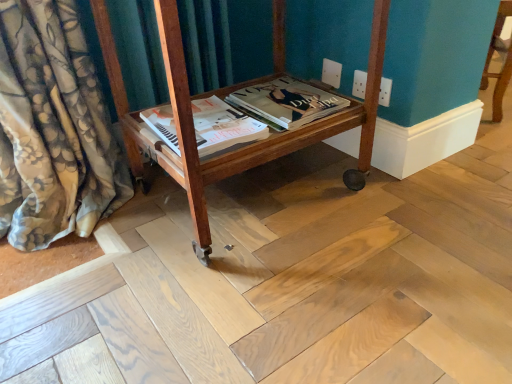
This screenshot has height=384, width=512. In order to click on wooden cart at center in this screenshot , I will do `click(240, 149)`.

Identify the location of wooden cart at center. This screenshot has height=384, width=512. (240, 149).

From a real-world perspective, who is located lower, matte paper magazine at center, which is the 1th magazine from left to right, or matte paper magazine at center, the second magazine in the left-to-right sequence?

matte paper magazine at center, the second magazine in the left-to-right sequence, is physically lower.

Which is nearer, (x=224, y=137) or (x=282, y=113)?

Point (x=224, y=137)

Could matte paper magazine at center, the second magazine in the left-to-right sequence, be considered to be inside matte paper magazine at center, which is the 1th magazine from left to right?

No, matte paper magazine at center, the second magazine in the left-to-right sequence, is located outside of matte paper magazine at center, which is the 1th magazine from left to right.

Looking at this image, is matte paper magazine at center, which is the 1th magazine from left to right, located within matte paper magazine at center, which appears as the 1th magazine when viewed from the right?

That's incorrect, matte paper magazine at center, which is the 1th magazine from left to right, is not inside matte paper magazine at center, which appears as the 1th magazine when viewed from the right.

Is matte paper magazine at center, which appears as the 1th magazine when viewed from the right, with matte paper magazine at center, the 2th magazine positioned from the right?

No, matte paper magazine at center, which appears as the 1th magazine when viewed from the right, is not with matte paper magazine at center, the 2th magazine positioned from the right.

Is matte paper magazine at center, the second magazine in the left-to-right sequence, taller or shorter than matte paper magazine at center, the 2th magazine positioned from the right?

Considering their sizes, matte paper magazine at center, the second magazine in the left-to-right sequence, has more height than matte paper magazine at center, the 2th magazine positioned from the right.

From a real-world perspective, is matte paper magazine at center, which appears as the 1th magazine when viewed from the right, over matte paper magazine at center, the 2th magazine positioned from the right?

No, from a real-world perspective, matte paper magazine at center, which appears as the 1th magazine when viewed from the right, is not over matte paper magazine at center, the 2th magazine positioned from the right

Considering the relative positions of wooden cart at center and matte paper magazine at center, which appears as the 1th magazine when viewed from the right, in the image provided, is wooden cart at center to the left of matte paper magazine at center, which appears as the 1th magazine when viewed from the right, from the viewer's perspective?

Indeed, wooden cart at center is positioned on the left side of matte paper magazine at center, which appears as the 1th magazine when viewed from the right.

Can you confirm if wooden cart at center is smaller than matte paper magazine at center, the second magazine in the left-to-right sequence?

No.

Does wooden cart at center turn towards matte paper magazine at center, which appears as the 1th magazine when viewed from the right?

Yes, wooden cart at center is oriented towards matte paper magazine at center, which appears as the 1th magazine when viewed from the right.

Would you say wooden cart at center is a long distance from matte paper magazine at center, which appears as the 1th magazine when viewed from the right?

That's not correct — wooden cart at center is a little close to matte paper magazine at center, which appears as the 1th magazine when viewed from the right.

Is matte paper magazine at center, the 2th magazine positioned from the right, bigger or smaller than wooden cart at center?

In the image, matte paper magazine at center, the 2th magazine positioned from the right, appears to be smaller than wooden cart at center.

Can you confirm if matte paper magazine at center, the 2th magazine positioned from the right, is shorter than wooden cart at center?

Yes, matte paper magazine at center, the 2th magazine positioned from the right, is shorter than wooden cart at center.

Where is `furniture on the right of matte paper magazine at center, which is the 1th magazine from left to right`? furniture on the right of matte paper magazine at center, which is the 1th magazine from left to right is located at coordinates (240, 149).

From the image's perspective, is wooden cart at center located beneath matte paper magazine at center, the 2th magazine positioned from the right?

No.

There is a matte paper magazine at center, which is the 1th magazine from left to right. Identify the location of furniture above it (from a real-world perspective). (240, 149).

Does point (201, 166) lie behind point (210, 110)?

No, (201, 166) is closer to viewer.

Does point (314, 91) appear closer or farther from the camera than point (139, 161)?

Point (314, 91) appears to be closer to the viewer than point (139, 161).

From a real-world perspective, is matte paper magazine at center, the second magazine in the left-to-right sequence, under wooden cart at center?

Correct, in the physical world, matte paper magazine at center, the second magazine in the left-to-right sequence, is lower than wooden cart at center.

Measure the distance from matte paper magazine at center, the second magazine in the left-to-right sequence, to wooden cart at center.

matte paper magazine at center, the second magazine in the left-to-right sequence, is 7.52 inches from wooden cart at center.

Where is `furniture that is in front of the matte paper magazine at center, the second magazine in the left-to-right sequence`? The image size is (512, 384). furniture that is in front of the matte paper magazine at center, the second magazine in the left-to-right sequence is located at coordinates (240, 149).

This screenshot has width=512, height=384. Identify the location of magazine lying on the left of matte paper magazine at center, the second magazine in the left-to-right sequence. (223, 126).

Identify the location of magazine located below the matte paper magazine at center, which appears as the 1th magazine when viewed from the right (from the image's perspective). Image resolution: width=512 pixels, height=384 pixels. (223, 126).

From the image, which object appears to be nearer to wooden cart at center, matte paper magazine at center, which appears as the 1th magazine when viewed from the right, or matte paper magazine at center, the 2th magazine positioned from the right?

matte paper magazine at center, the 2th magazine positioned from the right.

When comparing their distances from wooden cart at center, does matte paper magazine at center, the 2th magazine positioned from the right, or matte paper magazine at center, which appears as the 1th magazine when viewed from the right, seem further?

The object further to wooden cart at center is matte paper magazine at center, which appears as the 1th magazine when viewed from the right.

Based on their spatial positions, is matte paper magazine at center, which is the 1th magazine from left to right, or wooden cart at center closer to matte paper magazine at center, the second magazine in the left-to-right sequence?

matte paper magazine at center, which is the 1th magazine from left to right, lies closer to matte paper magazine at center, the second magazine in the left-to-right sequence, than the other object.

Considering their positions, is matte paper magazine at center, which appears as the 1th magazine when viewed from the right, positioned further to matte paper magazine at center, which is the 1th magazine from left to right, than wooden cart at center?

wooden cart at center.

Estimate the real-world distances between objects in this image. Which object is further from matte paper magazine at center, the 2th magazine positioned from the right, wooden cart at center or matte paper magazine at center, which appears as the 1th magazine when viewed from the right?

wooden cart at center is further to matte paper magazine at center, the 2th magazine positioned from the right.

When comparing their distances from matte paper magazine at center, the second magazine in the left-to-right sequence, does wooden cart at center or matte paper magazine at center, the 2th magazine positioned from the right, seem further?

wooden cart at center is positioned further to the anchor matte paper magazine at center, the second magazine in the left-to-right sequence.

The width and height of the screenshot is (512, 384). I want to click on magazine between wooden cart at center and matte paper magazine at center, which appears as the 1th magazine when viewed from the right, along the z-axis, so (223, 126).